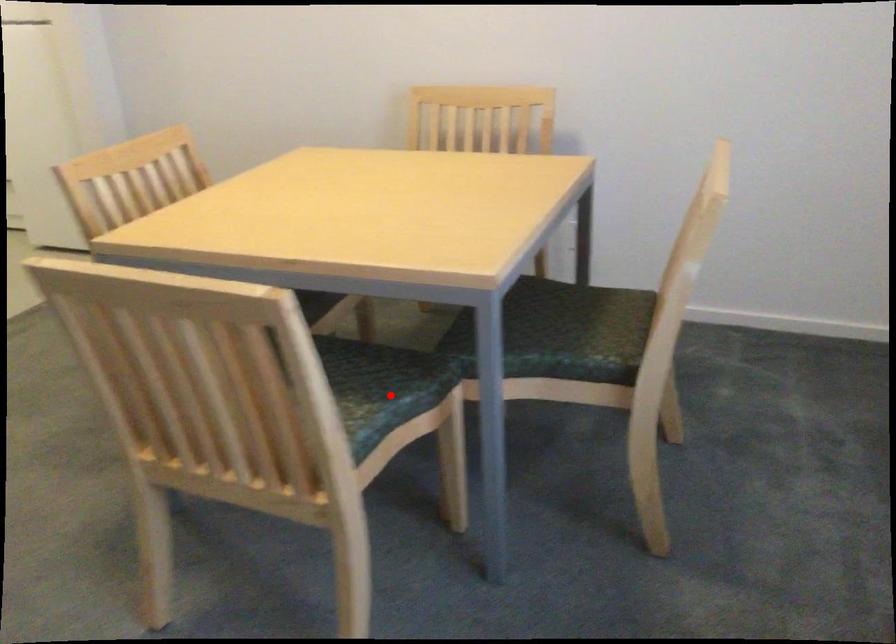
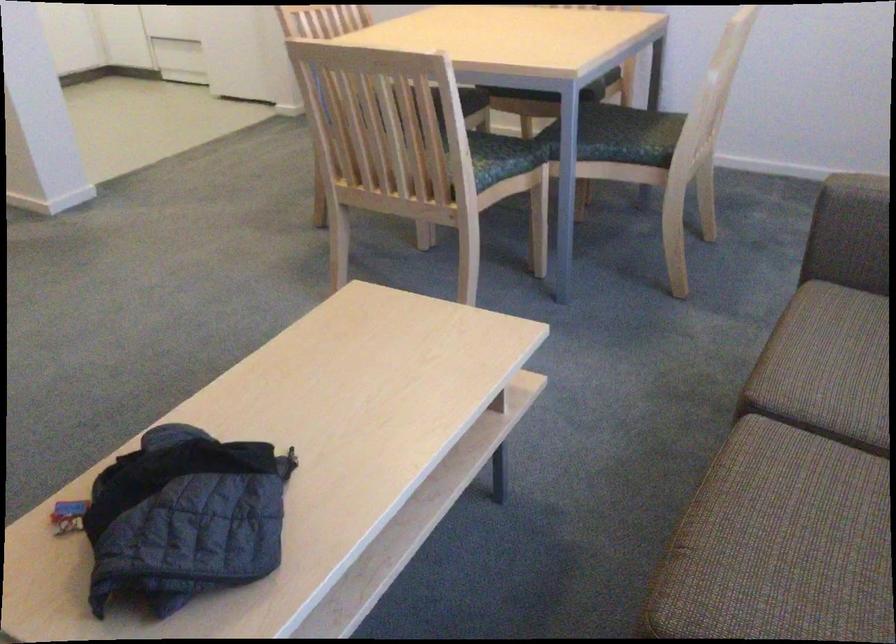
Question: I am providing you with two images of the same scene from different viewpoints. Given a red point in image1, look at the same physical point in image2. Is it:

Choices:
 (A) Closer to the viewpoint
 (B) Farther from the viewpoint

Answer: (B)